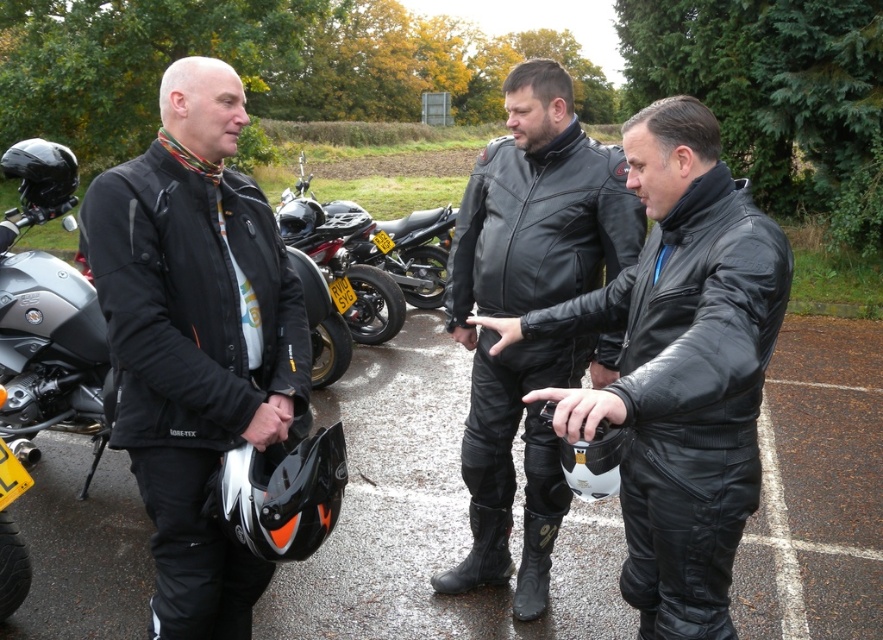
Question: Estimate the real-world distances between objects in this image. Which object is farther from the black leather jacket at center?

Choices:
 (A) black leather motorcycle at center
 (B) matte black leather jacket at center
 (C) black leather jacket at left
 (D) shiny black motorcycle at center

Answer: (A)

Question: Does black leather jacket at left come behind black leather jacket at center?

Choices:
 (A) yes
 (B) no

Answer: (B)

Question: Considering the relative positions of black leather jacket at left and black leather motorcycle at center in the image provided, where is black leather jacket at left located with respect to black leather motorcycle at center?

Choices:
 (A) right
 (B) left

Answer: (B)

Question: Among these points, which one is nearest to the camera?

Choices:
 (A) (341, 221)
 (B) (191, 474)
 (C) (378, 257)
 (D) (616, 189)

Answer: (B)

Question: Does black leather jacket at left appear under black leather jacket at center?

Choices:
 (A) no
 (B) yes

Answer: (B)

Question: Among these points, which one is farthest from the camera?

Choices:
 (A) (538, 344)
 (B) (640, 180)
 (C) (217, 83)
 (D) (352, 264)

Answer: (D)